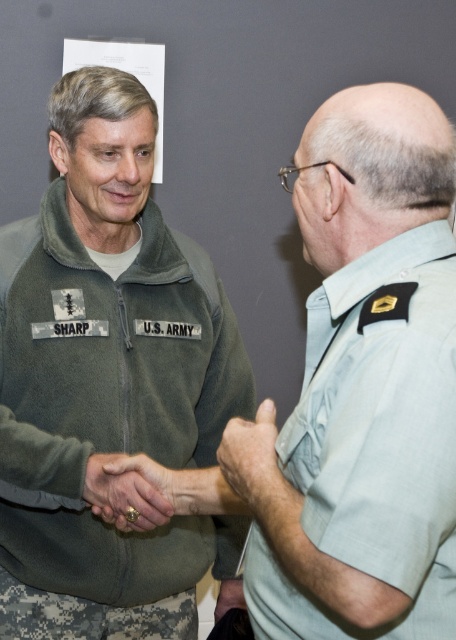
Question: Can you confirm if smooth skin hand at center is bigger than matte gray hand at lower center?

Choices:
 (A) yes
 (B) no

Answer: (B)

Question: Considering the real-world distances, which object is closest to the smooth skin hand at center?

Choices:
 (A) matte gray hand at lower center
 (B) green fleece jacket at center

Answer: (B)

Question: Which of the following is the farthest from the observer?

Choices:
 (A) gold ring at center
 (B) green fleece jacket at center
 (C) matte gray hand at lower center

Answer: (C)

Question: Considering the real-world distances, which object is farthest from the matte gray hand at lower center?

Choices:
 (A) smooth skin hand at center
 (B) light blue fabric at upper right
 (C) green fleece jacket at center
 (D) gold ring at center

Answer: (B)

Question: In this image, where is green fleece jacket at center located relative to light blue fabric at upper right?

Choices:
 (A) right
 (B) left

Answer: (B)

Question: Does light blue fabric at upper right appear on the right side of gold ring at center?

Choices:
 (A) no
 (B) yes

Answer: (B)